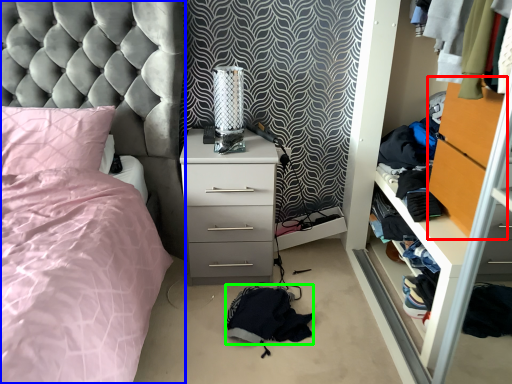
Question: Which object is the closest to the file cabinet (highlighted by a red box)? Choose among these: bed (highlighted by a blue box) or clothing (highlighted by a green box).

Choices:
 (A) bed
 (B) clothing

Answer: (B)